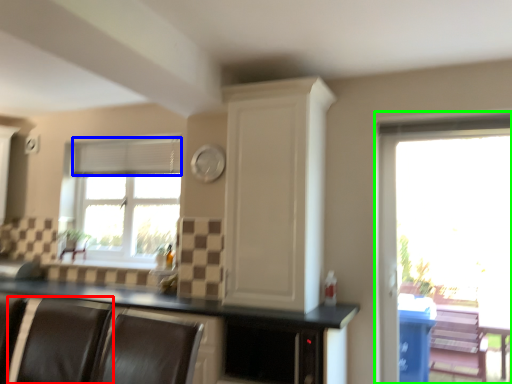
Question: Which is farther away from armchair (highlighted by a red box)? blind (highlighted by a blue box) or window (highlighted by a green box)?

Choices:
 (A) blind
 (B) window

Answer: (B)